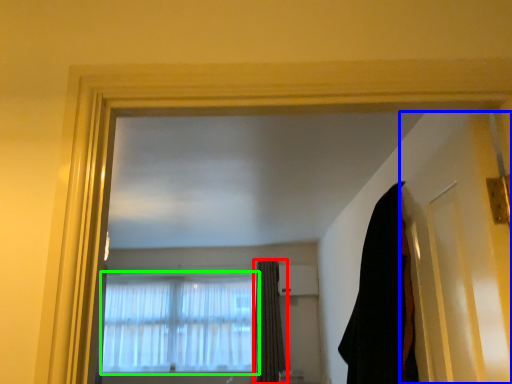
Question: Which is nearer to the curtain (highlighted by a red box)? door (highlighted by a blue box) or window (highlighted by a green box).

Choices:
 (A) door
 (B) window

Answer: (B)